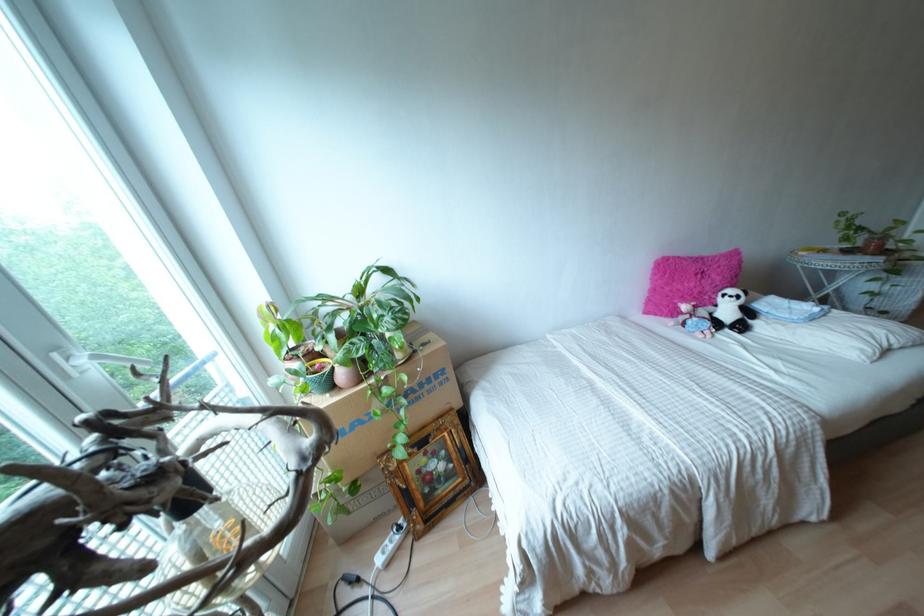
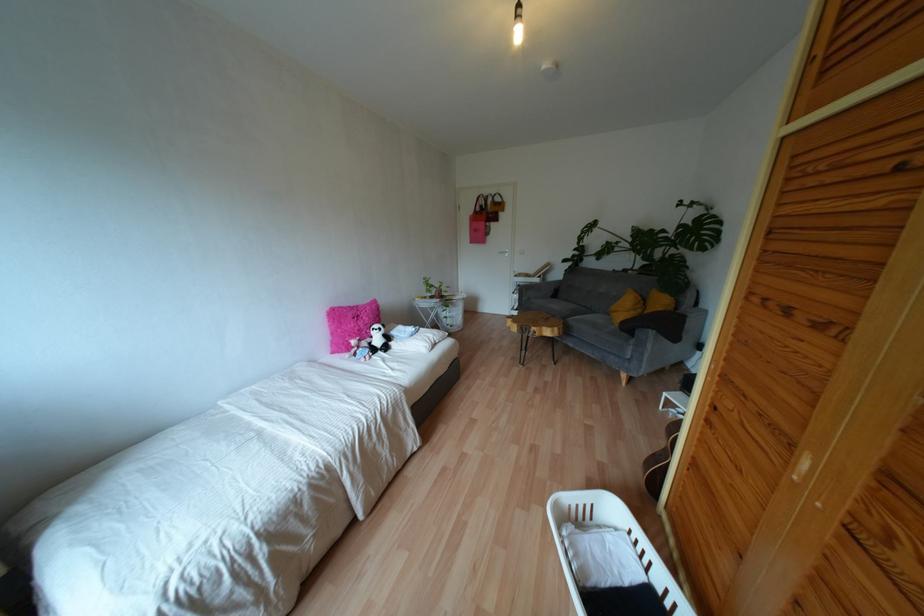
In the second image, find the point that corresponds to (x=725, y=330) in the first image.

(379, 352)